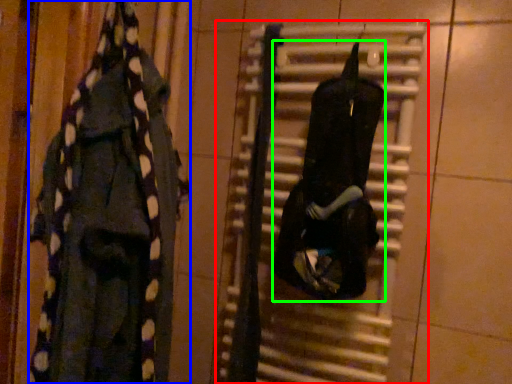
Question: Which is nearer to the radiator (highlighted by a red box)? clothing (highlighted by a blue box) or clothing (highlighted by a green box).

Choices:
 (A) clothing
 (B) clothing

Answer: (B)